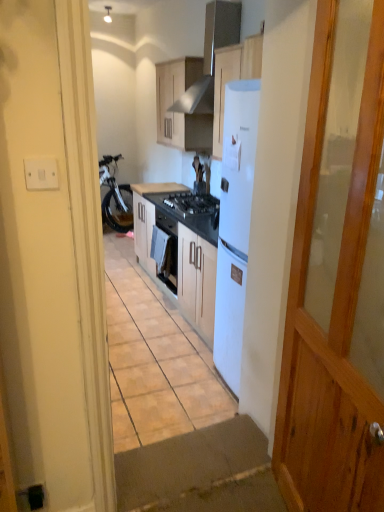
Question: From a real-world perspective, is white glossy refrigerator at upper center above or below matte wood cabinet at upper center, which is counted as the 2th cabinetry, starting from the bottom?

Choices:
 (A) below
 (B) above

Answer: (B)

Question: From the image's perspective, is white glossy refrigerator at upper center above or below matte wood cabinet at upper center, marked as the 1th cabinetry in a top-to-bottom arrangement?

Choices:
 (A) below
 (B) above

Answer: (B)

Question: Estimate the real-world distances between objects in this image. Which object is closer to the white glossy refrigerator at upper center?

Choices:
 (A) white matte cabinet at center, the second cabinetry viewed from the top
 (B) matte wood cabinet at upper center, marked as the 1th cabinetry in a top-to-bottom arrangement
 (C) black matte gas stove at center
 (D) white plastic switch at left

Answer: (B)

Question: Based on their relative distances, which object is nearer to the black matte gas stove at center?

Choices:
 (A) white plastic switch at left
 (B) white matte cabinet at center, the second cabinetry viewed from the top
 (C) white glossy refrigerator at upper center
 (D) matte wood cabinet at upper center, which is counted as the 2th cabinetry, starting from the bottom

Answer: (B)